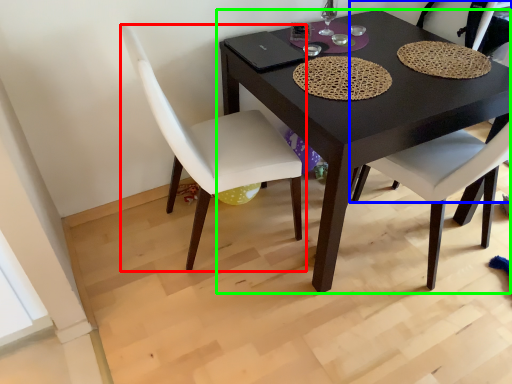
Question: Which object is the closest to the chair (highlighted by a red box)? Choose among these: chair (highlighted by a blue box) or table (highlighted by a green box).

Choices:
 (A) chair
 (B) table

Answer: (B)